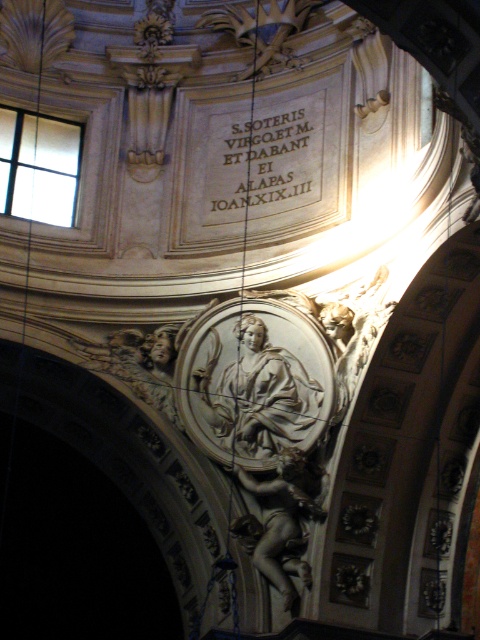
Is the position of silver metallic statue at center more distant than that of white stone inscription at upper center?

No, silver metallic statue at center is closer to the viewer.

Which is behind, point (230, 369) or point (310, 109)?

The point (310, 109) is behind.

Find the location of `silver metallic statue at center`. silver metallic statue at center is located at coordinates (256, 394).

Is white stone inscription at upper center bigger than gray stone cherub at center?

Indeed, white stone inscription at upper center has a larger size compared to gray stone cherub at center.

Does white stone inscription at upper center come behind gray stone cherub at center?

That is True.

Does point (309, 124) lie behind point (298, 552)?

Yes.

Locate an element on the screen. This screenshot has width=480, height=640. white stone inscription at upper center is located at coordinates (264, 163).

Which is behind, point (250, 412) or point (291, 570)?

The point (250, 412) is behind.

Between point (282, 394) and point (248, 548), which one is positioned in front?

Point (282, 394) is in front.

At what (x,y) coordinates should I click in order to perform the action: click on silver metallic statue at center. Please return your answer as a coordinate pair (x, y). This screenshot has height=640, width=480. Looking at the image, I should click on (256, 394).

Where is `silver metallic statue at center`? This screenshot has height=640, width=480. silver metallic statue at center is located at coordinates (256, 394).